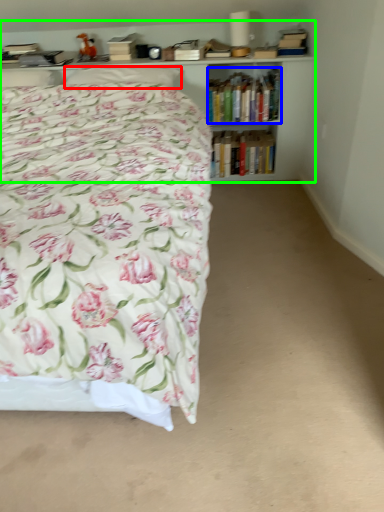
Question: Which object is positioned closest to pillow (highlighted by a red box)? Select from book (highlighted by a blue box) and bookcase (highlighted by a green box).

Choices:
 (A) book
 (B) bookcase

Answer: (B)